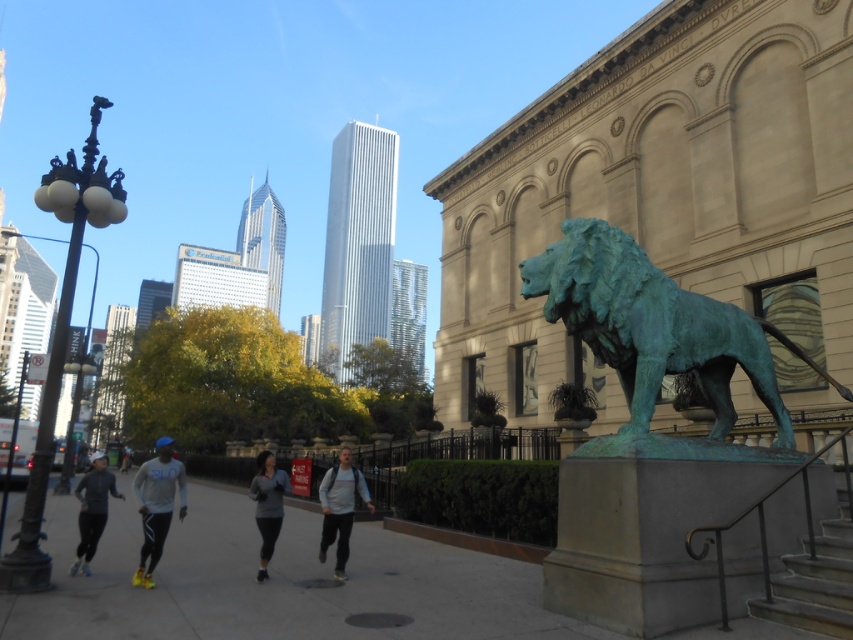
Is metallic gray stairs at lower right shorter than gray fabric jacket at center?

Correct, metallic gray stairs at lower right is not as tall as gray fabric jacket at center.

Does point (838, 595) lie in front of point (259, 456)?

Yes, it is.

Is point (811, 582) behind point (277, 506)?

No, (811, 582) is closer to viewer.

The width and height of the screenshot is (853, 640). Find the location of `metallic gray stairs at lower right`. metallic gray stairs at lower right is located at coordinates (815, 580).

Is green patina lion at right wider than matte blue hoodie at center?

Incorrect, green patina lion at right's width does not surpass matte blue hoodie at center's.

The height and width of the screenshot is (640, 853). In order to click on green patina lion at right in this screenshot , I will do `click(654, 326)`.

Which is above, matte blue hoodie at center or gray fabric jacket at center?

gray fabric jacket at center

Does point (155, 449) come farther from viewer compared to point (267, 561)?

Yes, it is.

This screenshot has height=640, width=853. What are the coordinates of `matte blue hoodie at center` in the screenshot? It's located at (157, 504).